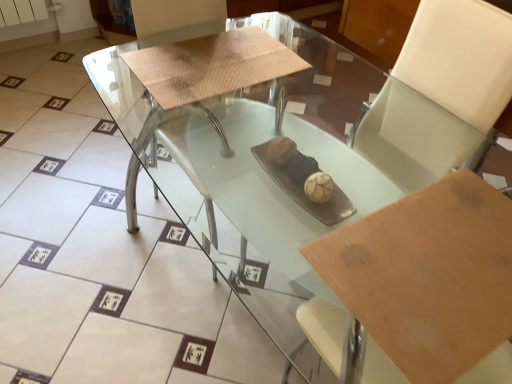
The width and height of the screenshot is (512, 384). In order to click on white leather swivel chair at upper right in this screenshot , I will do `click(440, 92)`.

Image resolution: width=512 pixels, height=384 pixels. What do you see at coordinates (440, 92) in the screenshot? I see `white leather swivel chair at upper right` at bounding box center [440, 92].

What are the coordinates of `white leather swivel chair at upper right` in the screenshot? It's located at (440, 92).